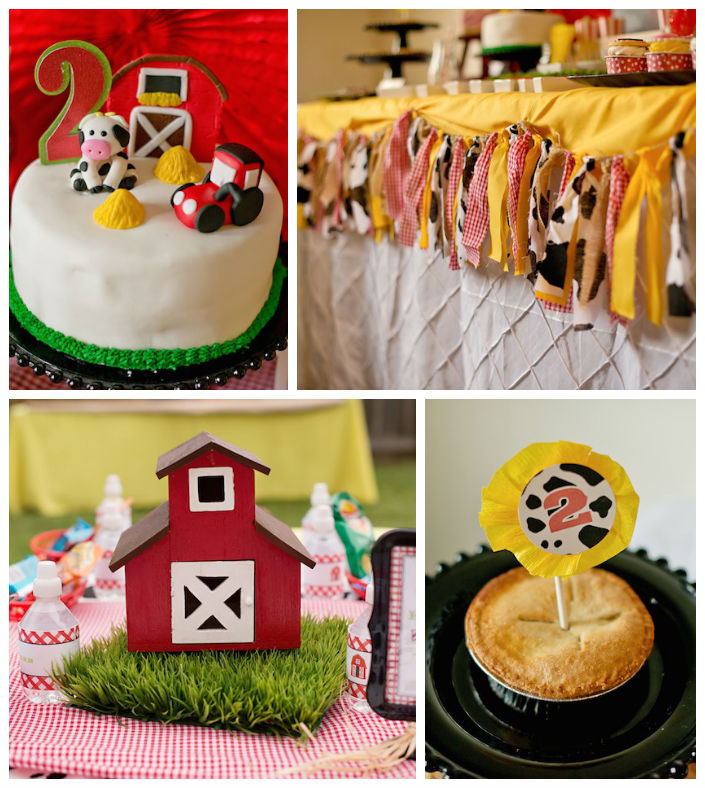
Find the location of `plate`. plate is located at coordinates (673, 688).